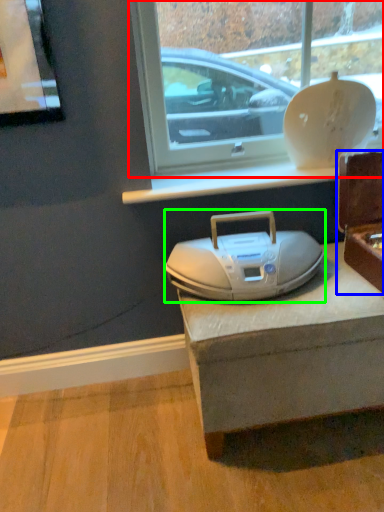
Question: Which object is positioned farthest from window (highlighted by a red box)? Select from box (highlighted by a blue box) and appliance (highlighted by a green box).

Choices:
 (A) box
 (B) appliance

Answer: (B)